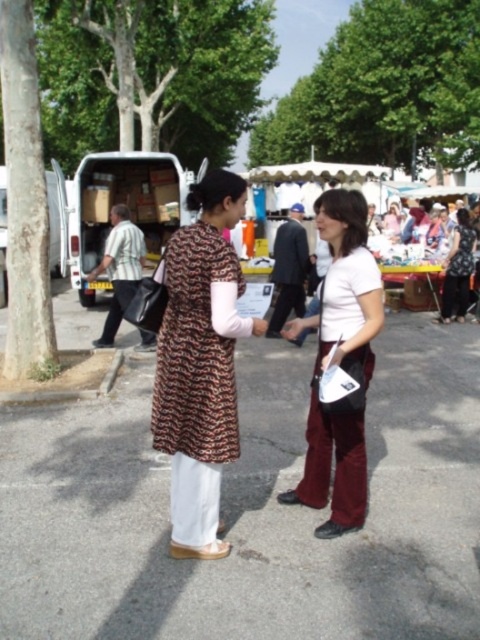
Based on the photo, you are standing in the middle of the paved area at the market. There are two points marked in the scene. The first point is at coordinates point (188, 243) and the second point is at point (94, 268). Which point is closer to you?

Point (188, 243) is in front of point (94, 268), so it is closer to you.

You are a photographer positioned at the edge of the scene and want to capture both the brown printed dress at center and the matte black dress at center in a single frame. Given that your camera has a maximum focus range of 7 meters, will you be able to include both subjects in sharp focus?

The distance between the brown printed dress at center and the matte black dress at center is 7.26 meters. Since the camera can only focus up to 7 meters, the subjects are slightly beyond the focus range, so they cannot both be in sharp focus in a single frame.

You are a photographer trying to capture a group photo of the white matte shirt at center and the dark suit at center. Since you want both subjects to be in focus, you need to know which one is shorter. Which one is shorter?

The white matte shirt at center is shorter than the dark suit at center, so you should adjust your camera focus accordingly to ensure both are in focus.